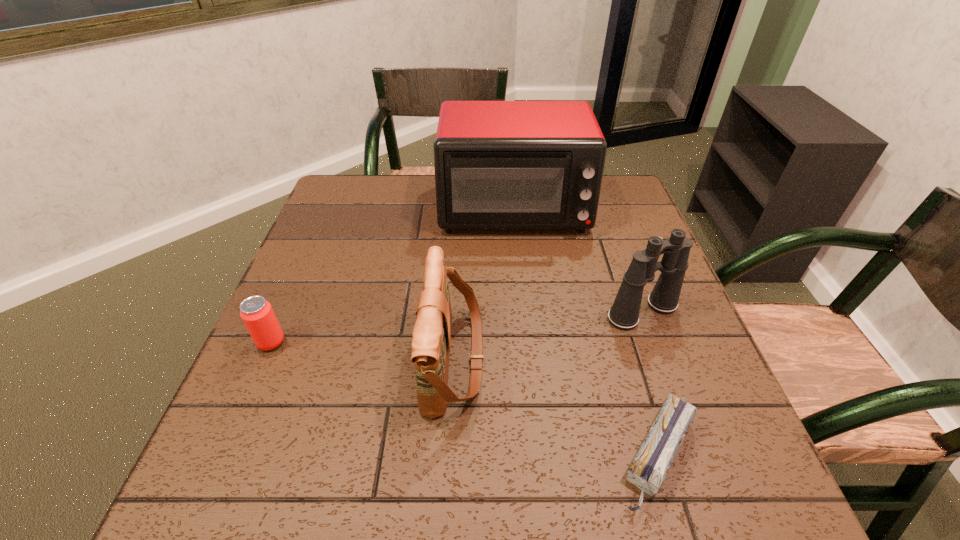
The width and height of the screenshot is (960, 540). In order to click on free space between the shortest object and the shoulder bag in this screenshot , I will do `click(556, 407)`.

At what (x,y) coordinates should I click in order to perform the action: click on empty location between the beer can and the shoulder bag. Please return your answer as a coordinate pair (x, y). Looking at the image, I should click on (363, 350).

Identify the location of free spot between the tallest object and the pencil box. The width and height of the screenshot is (960, 540). (586, 332).

Find the location of a particular element. This screenshot has height=540, width=960. free space between the pencil box and the shoulder bag is located at coordinates (556, 407).

Identify which object is located as the fourth nearest to the shoulder bag. Please provide its 2D coordinates. Your answer should be formatted as a tuple, i.e. [(x, y)], where the tuple contains the x and y coordinates of a point satisfying the conditions above.

[(257, 314)]

The image size is (960, 540). Find the location of `object that is the fourth closest one to the shortest object`. object that is the fourth closest one to the shortest object is located at coordinates (257, 314).

Find the location of `vacant space that satisfies the following two spatial constraints: 1. on the front-facing side of the shortest object; 2. on the left side of the shoulder bag`. vacant space that satisfies the following two spatial constraints: 1. on the front-facing side of the shortest object; 2. on the left side of the shoulder bag is located at coordinates (449, 456).

You are a GUI agent. You are given a task and a screenshot of the screen. Output one action in this format:
    pyautogui.click(x=<x>, y=<y>)
    Task: Click on the vacant region that satisfies the following two spatial constraints: 1. on the front-facing side of the shortest object; 2. on the right side of the shoulder bag
    
    Given the screenshot: What is the action you would take?
    pyautogui.click(x=449, y=456)

In order to click on free space that satisfies the following two spatial constraints: 1. on the front side of the binoculars; 2. on the front-facing side of the shoulder bag in this screenshot , I will do `click(660, 359)`.

You are a GUI agent. You are given a task and a screenshot of the screen. Output one action in this format:
    pyautogui.click(x=<x>, y=<y>)
    Task: Click on the vacant space that satisfies the following two spatial constraints: 1. on the front-facing side of the tallest object; 2. on the front-facing side of the shoulder bag
    This screenshot has height=540, width=960.
    Given the screenshot: What is the action you would take?
    pyautogui.click(x=528, y=359)